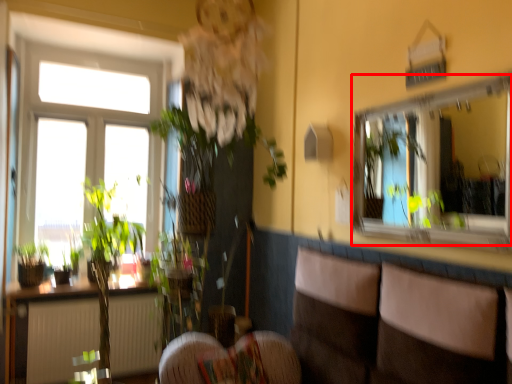
Question: From the image's perspective, what is the correct spatial positioning of mirror (annotated by the red box) in reference to couch?

Choices:
 (A) above
 (B) below

Answer: (A)